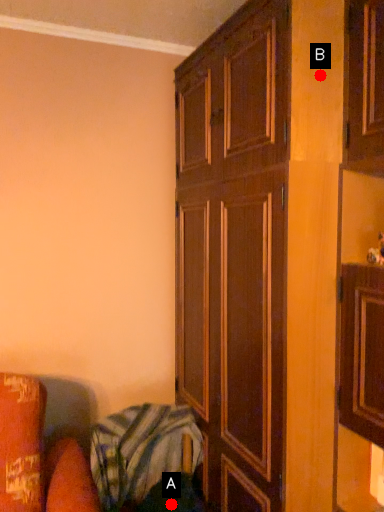
Question: Two points are circled on the image, labeled by A and B beside each circle. Which point is closer to the camera?

Choices:
 (A) A is closer
 (B) B is closer

Answer: (B)